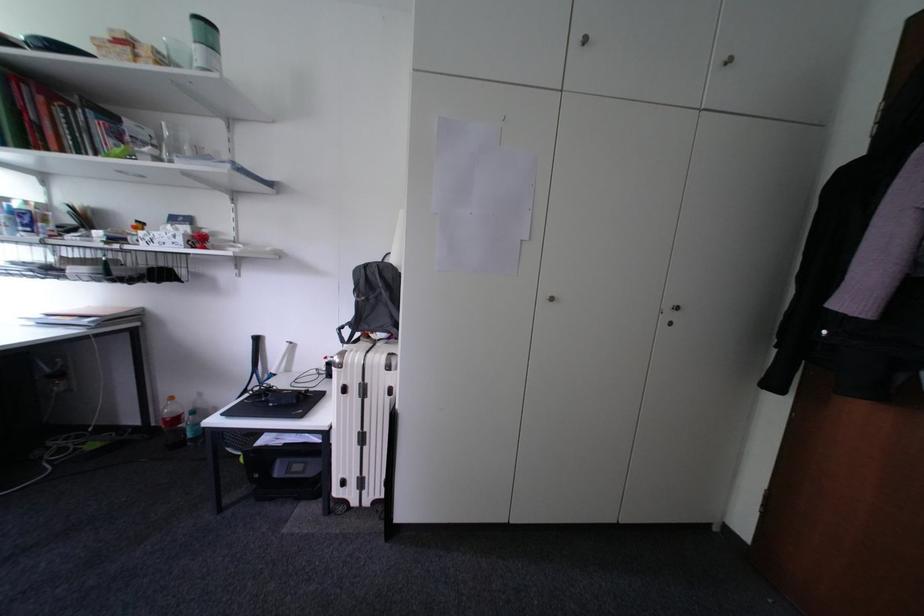
Which object does [361,419] point to?

It refers to a white suitcase.